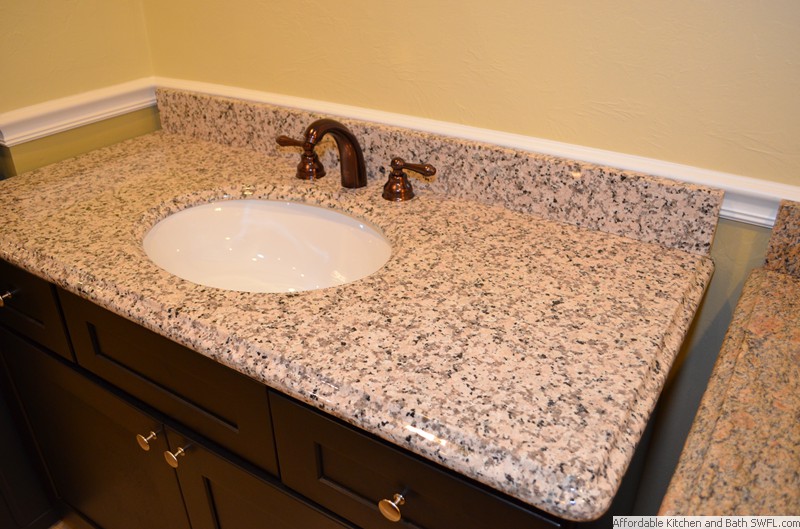
In order to click on faucet in this screenshot , I will do `click(316, 139)`.